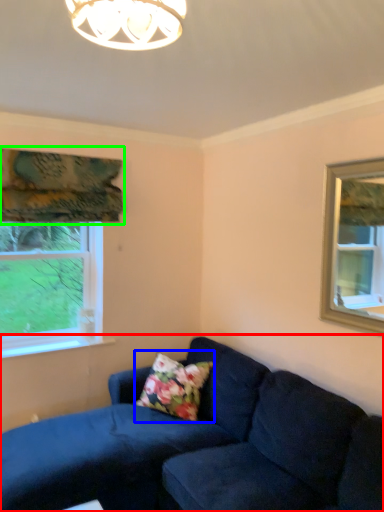
Question: Which object is positioned farthest from studio couch (highlighted by a red box)? Select from pillow (highlighted by a blue box) and curtain (highlighted by a green box).

Choices:
 (A) pillow
 (B) curtain

Answer: (B)